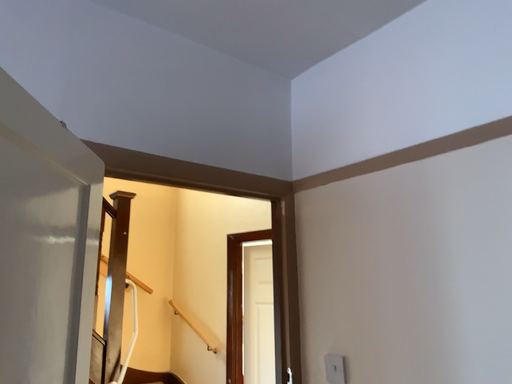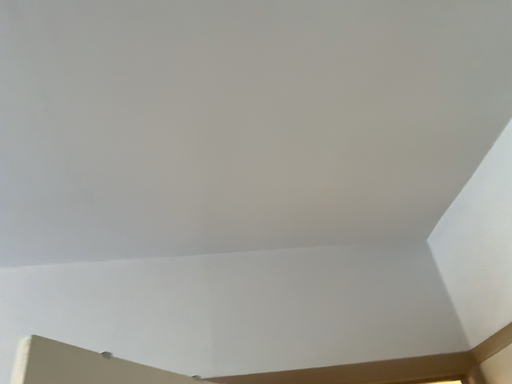
Question: How did the camera likely rotate when shooting the video?

Choices:
 (A) rotated upward
 (B) rotated downward

Answer: (A)